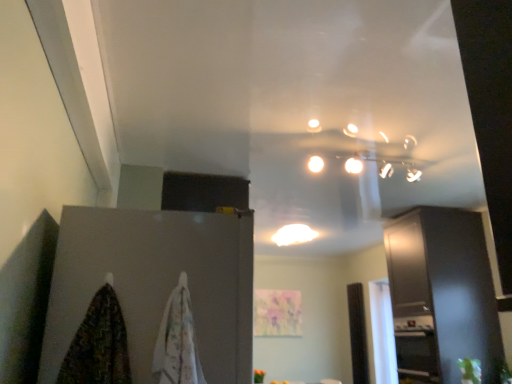
In order to click on matte gray cabinet at left, the second cabinetry positioned from the back in this screenshot , I will do `click(156, 284)`.

Does point (286, 231) lie in front of point (78, 346)?

No, (286, 231) is behind (78, 346).

Based on the photo, is white glossy light fixture at center not near multicolored fabric at lower left, the first blanket positioned from the left?

Yes, white glossy light fixture at center is far from multicolored fabric at lower left, the first blanket positioned from the left.

Is white glossy light fixture at center not within multicolored fabric at lower left, which is the second blanket in right-to-left order?

Yes, white glossy light fixture at center is not within multicolored fabric at lower left, which is the second blanket in right-to-left order.

Considering the sizes of white cotton towel at lower left, which appears as the 1th blanket when viewed from the right, and white glossy light fixture at center in the image, is white cotton towel at lower left, which appears as the 1th blanket when viewed from the right, wider or thinner than white glossy light fixture at center?

In the image, white cotton towel at lower left, which appears as the 1th blanket when viewed from the right, appears to be more narrow than white glossy light fixture at center.

Is white cotton towel at lower left, arranged as the second blanket when viewed from the left, positioned beyond the bounds of white glossy light fixture at center?

white cotton towel at lower left, arranged as the second blanket when viewed from the left, is positioned outside white glossy light fixture at center.

From a real-world perspective, is white cotton towel at lower left, which appears as the 1th blanket when viewed from the right, positioned under white glossy light fixture at center based on gravity?

Indeed, from a real-world perspective, white cotton towel at lower left, which appears as the 1th blanket when viewed from the right, is positioned beneath white glossy light fixture at center.

Which of these two, white cotton towel at lower left, which appears as the 1th blanket when viewed from the right, or white glossy light fixture at center, stands taller?

With more height is white cotton towel at lower left, which appears as the 1th blanket when viewed from the right.

Which blanket is the 2nd one when counting from the front of the white glossy light fixture at center? Please provide its 2D coordinates.

[(98, 345)]

Considering the points (113, 353) and (296, 227), which point is in front, point (113, 353) or point (296, 227)?

The point (113, 353) is in front.

Can you tell me how much multicolored fabric at lower left, which is the second blanket in right-to-left order, and white glossy light fixture at center differ in facing direction?

The facing directions of multicolored fabric at lower left, which is the second blanket in right-to-left order, and white glossy light fixture at center are 1.8 degrees apart.

Which is correct: multicolored fabric at lower left, which is the second blanket in right-to-left order, is inside white glossy light fixture at center, or outside of it?

multicolored fabric at lower left, which is the second blanket in right-to-left order, is spatially situated outside white glossy light fixture at center.

From the image's perspective, relative to satin black cabinet at right, the second cabinetry when ordered from left to right, is matte gray cabinet at left, the first cabinetry positioned from the front, above or below?

matte gray cabinet at left, the first cabinetry positioned from the front, is above satin black cabinet at right, the second cabinetry when ordered from left to right.

Which object is positioned more to the right, matte gray cabinet at left, the second cabinetry positioned from the back, or satin black cabinet at right, the first cabinetry from the back?

Positioned to the right is satin black cabinet at right, the first cabinetry from the back.

Does point (220, 260) lie in front of point (395, 247)?

Yes, point (220, 260) is closer to viewer.

In terms of height, does matte gray cabinet at left, the first cabinetry positioned from the front, look taller or shorter compared to satin black cabinet at right, positioned as the first cabinetry in right-to-left order?

Considering their sizes, matte gray cabinet at left, the first cabinetry positioned from the front, has less height than satin black cabinet at right, positioned as the first cabinetry in right-to-left order.

Which point is more distant from viewer, (222,281) or (196,372)?

The point (222,281) is behind.

Is matte gray cabinet at left, arranged as the second cabinetry when viewed from the right, oriented towards white cotton towel at lower left, which appears as the 1th blanket when viewed from the right?

No, matte gray cabinet at left, arranged as the second cabinetry when viewed from the right, is not turned towards white cotton towel at lower left, which appears as the 1th blanket when viewed from the right.

Looking at the image, does matte gray cabinet at left, arranged as the second cabinetry when viewed from the right, seem bigger or smaller compared to white cotton towel at lower left, which appears as the 1th blanket when viewed from the right?

Clearly, matte gray cabinet at left, arranged as the second cabinetry when viewed from the right, is larger in size than white cotton towel at lower left, which appears as the 1th blanket when viewed from the right.

Identify the location of blanket that is the 1st one when counting upward from the matte gray cabinet at left, arranged as the second cabinetry when viewed from the right (from the image's perspective). The width and height of the screenshot is (512, 384). (177, 341).

Is matte gray cabinet at left, the second cabinetry positioned from the back, turned away from white glossy light fixture at center?

matte gray cabinet at left, the second cabinetry positioned from the back, is not turned away from white glossy light fixture at center.

Considering the positions of points (200, 293) and (311, 238), is point (200, 293) closer to camera compared to point (311, 238)?

Yes.

Considering the sizes of objects matte gray cabinet at left, arranged as the second cabinetry when viewed from the right, and white glossy light fixture at center in the image provided, who is taller, matte gray cabinet at left, arranged as the second cabinetry when viewed from the right, or white glossy light fixture at center?

matte gray cabinet at left, arranged as the second cabinetry when viewed from the right, is taller.

From a real-world perspective, is matte gray cabinet at left, the 1th cabinetry in the left-to-right sequence, beneath white glossy light fixture at center?

Yes.

Considering the sizes of satin black cabinet at right, positioned as the first cabinetry in right-to-left order, and multicolored fabric at lower left, the first blanket positioned from the left, in the image, is satin black cabinet at right, positioned as the first cabinetry in right-to-left order, taller or shorter than multicolored fabric at lower left, the first blanket positioned from the left,?

satin black cabinet at right, positioned as the first cabinetry in right-to-left order, is taller than multicolored fabric at lower left, the first blanket positioned from the left.

Looking at this image, is satin black cabinet at right, the second cabinetry when ordered from left to right, inside or outside of multicolored fabric at lower left, which is the second blanket in right-to-left order?

The correct answer is: outside.

Consider the image. Between satin black cabinet at right, which is the 2th cabinetry from front to back, and multicolored fabric at lower left, the first blanket positioned from the left, which one appears on the right side from the viewer's perspective?

Positioned to the right is satin black cabinet at right, which is the 2th cabinetry from front to back.

From the white glossy light fixture at center, count the 2nd blanket to the left and point to it. Please provide its 2D coordinates.

[(98, 345)]

This screenshot has height=384, width=512. Find the location of `lighting on the right of white cotton towel at lower left, arranged as the second blanket when viewed from the left`. lighting on the right of white cotton towel at lower left, arranged as the second blanket when viewed from the left is located at coordinates (293, 234).

Looking at the image, which one is located closer to multicolored fabric at lower left, the first blanket positioned from the left, white glossy light fixture at center or satin black cabinet at right, positioned as the first cabinetry in right-to-left order?

satin black cabinet at right, positioned as the first cabinetry in right-to-left order.

From the image, which object appears to be nearer to white cotton towel at lower left, arranged as the second blanket when viewed from the left, matte gray cabinet at left, arranged as the second cabinetry when viewed from the right, or multicolored fabric at lower left, the first blanket positioned from the left?

matte gray cabinet at left, arranged as the second cabinetry when viewed from the right, is positioned closer to the anchor white cotton towel at lower left, arranged as the second blanket when viewed from the left.

From the picture: Which object lies nearer to the anchor point white cotton towel at lower left, arranged as the second blanket when viewed from the left, satin black cabinet at right, the first cabinetry from the back, or white glossy light fixture at center?

satin black cabinet at right, the first cabinetry from the back.

Which object lies nearer to the anchor point multicolored fabric at lower left, which is the second blanket in right-to-left order, white cotton towel at lower left, arranged as the second blanket when viewed from the left, or satin black cabinet at right, the second cabinetry when ordered from left to right?

white cotton towel at lower left, arranged as the second blanket when viewed from the left, is positioned closer to the anchor multicolored fabric at lower left, which is the second blanket in right-to-left order.

Based on their spatial positions, is multicolored fabric at lower left, which is the second blanket in right-to-left order, or white glossy light fixture at center closer to satin black cabinet at right, the first cabinetry from the back?

Among the two, white glossy light fixture at center is located nearer to satin black cabinet at right, the first cabinetry from the back.

From the image, which object appears to be nearer to matte gray cabinet at left, the 1th cabinetry in the left-to-right sequence, white glossy light fixture at center or white cotton towel at lower left, arranged as the second blanket when viewed from the left?

Based on the image, white cotton towel at lower left, arranged as the second blanket when viewed from the left, appears to be nearer to matte gray cabinet at left, the 1th cabinetry in the left-to-right sequence.

Estimate the real-world distances between objects in this image. Which object is further from satin black cabinet at right, the first cabinetry from the back, multicolored fabric at lower left, the first blanket positioned from the left, or matte gray cabinet at left, arranged as the second cabinetry when viewed from the right?

Among the two, multicolored fabric at lower left, the first blanket positioned from the left, is located further to satin black cabinet at right, the first cabinetry from the back.

Based on their spatial positions, is white cotton towel at lower left, which appears as the 1th blanket when viewed from the right, or satin black cabinet at right, the first cabinetry from the back, further from matte gray cabinet at left, the first cabinetry positioned from the front?

Among the two, satin black cabinet at right, the first cabinetry from the back, is located further to matte gray cabinet at left, the first cabinetry positioned from the front.

Locate an element on the screen. The height and width of the screenshot is (384, 512). cabinetry between matte gray cabinet at left, the second cabinetry positioned from the back, and white glossy light fixture at center in the front-back direction is located at coordinates (442, 295).

Locate an element on the screen. The width and height of the screenshot is (512, 384). cabinetry between multicolored fabric at lower left, the first blanket positioned from the left, and satin black cabinet at right, which is the 2th cabinetry from front to back, from left to right is located at coordinates (156, 284).

Image resolution: width=512 pixels, height=384 pixels. I want to click on blanket between multicolored fabric at lower left, which is the second blanket in right-to-left order, and white glossy light fixture at center in the front-back direction, so click(177, 341).

Image resolution: width=512 pixels, height=384 pixels. In order to click on blanket between multicolored fabric at lower left, which is the second blanket in right-to-left order, and satin black cabinet at right, the second cabinetry when ordered from left to right, along the z-axis in this screenshot , I will do `click(177, 341)`.